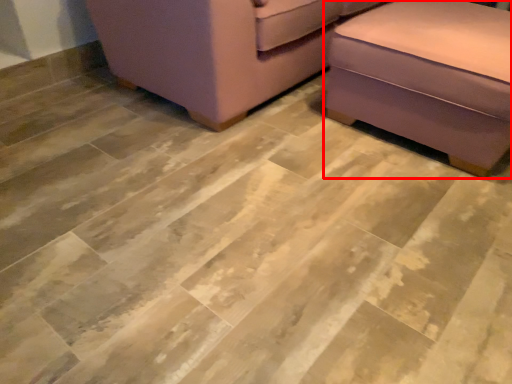
Question: From the image's perspective, where is furniture (annotated by the red box) located relative to furniture?

Choices:
 (A) below
 (B) above

Answer: (A)